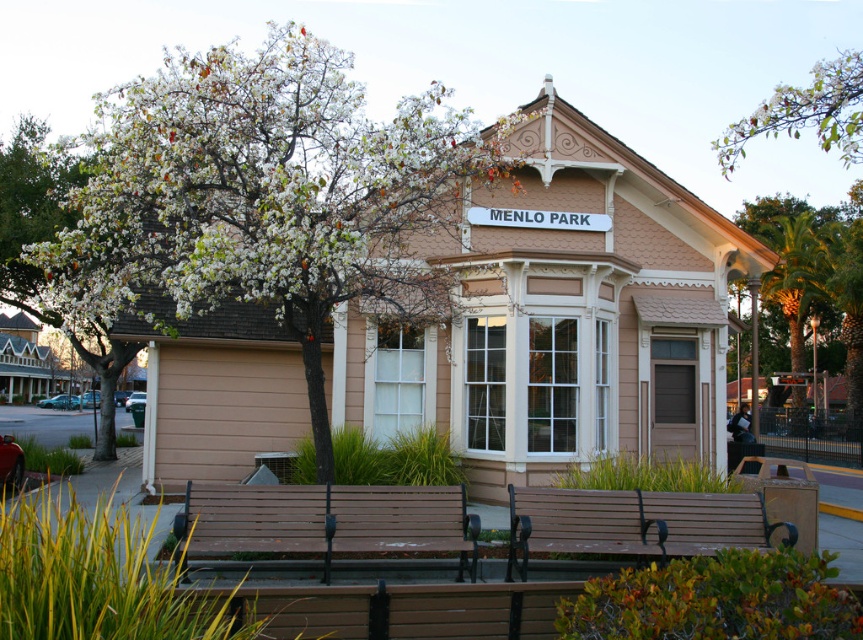
What are the coordinates of the white blossoming tree at upper left in the image?

The white blossoming tree at upper left is located at coordinates point [268,198].

From the picture: You are standing at the entrance of the Menlo Park building and want to sit on the brown wooden bench at lower center. Based on the coordinates provided, can you estimate how far you need to walk from the entrance to reach the bench?

The brown wooden bench at lower center is located at coordinates point (634, 524), which means it is approximately 81.9 centimeters to the right and 73.6 centimeters downward from the entrance. Therefore, you would need to walk about 1.15 meters diagonally to reach it.

You are standing at the entrance of the Menlo Park building and want to sit down. There is a brown wooden bench at lower center. Can you estimate the coordinates of the bench to find it?

The brown wooden bench at lower center is located at coordinates point (634, 524).